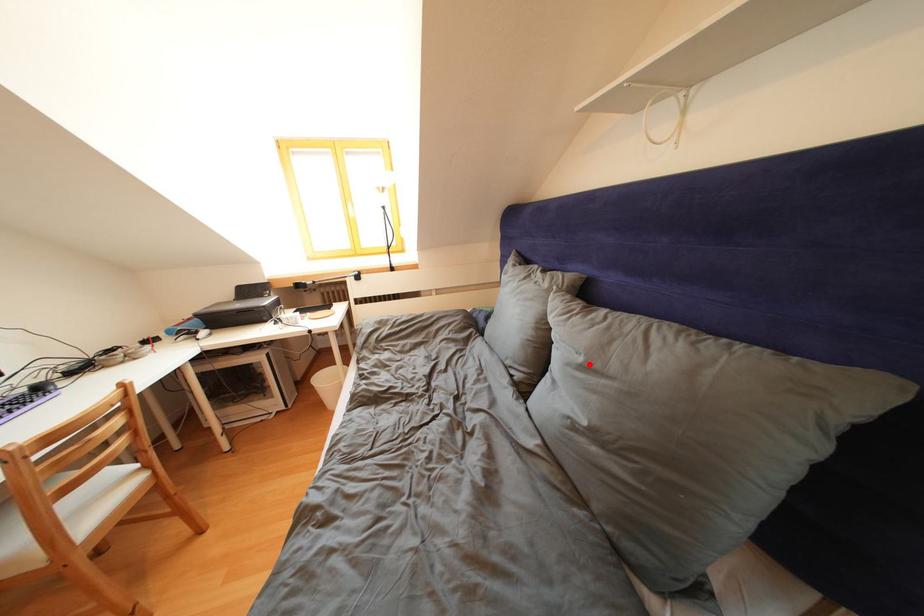
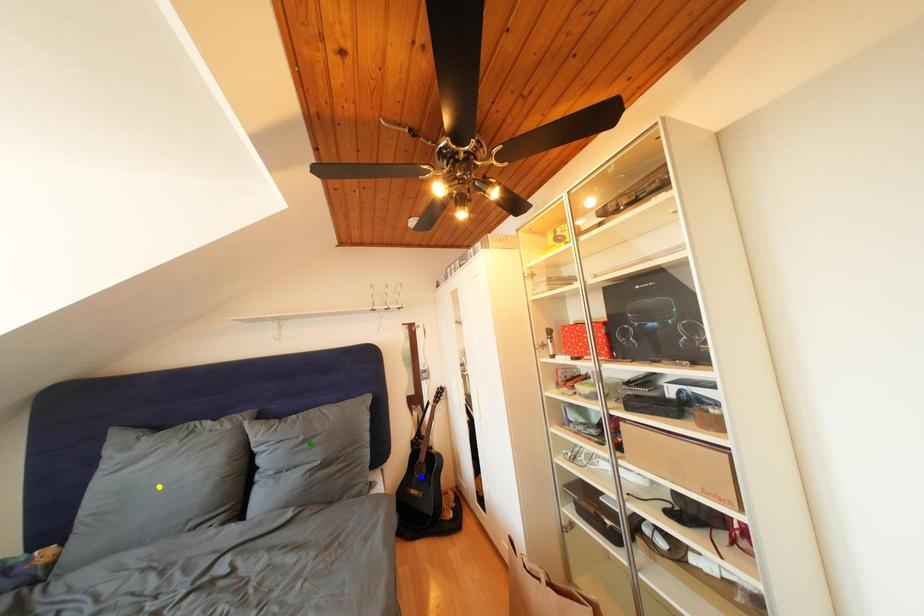
Question: I am providing you with two images of the same scene from different viewpoints. A red point is marked on the first image. You are given multiple points on the second image. Can you choose the point in image 2 that corresponds to the point in image 1?

Choices:
 (A) blue point
 (B) green point
 (C) yellow point

Answer: (B)